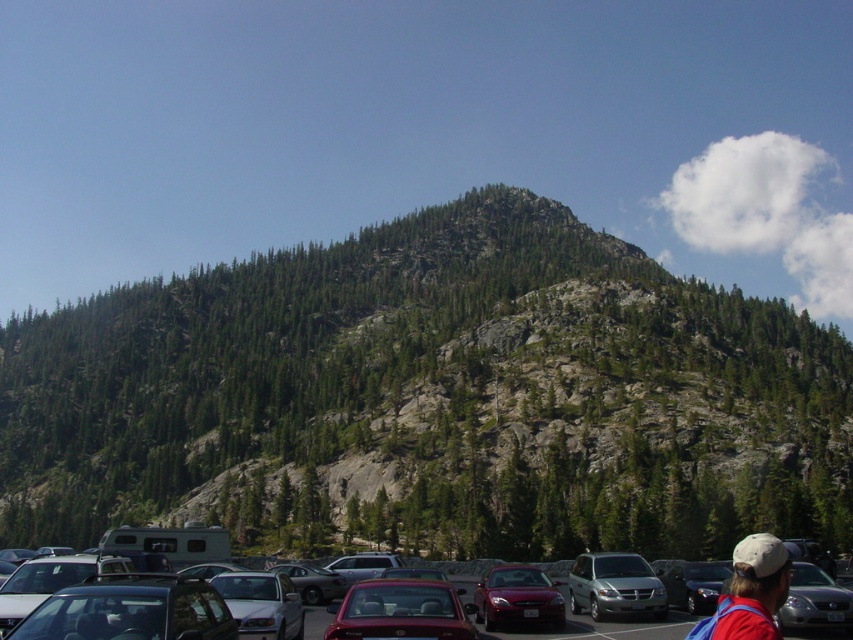
Question: Which of these objects is positioned closest to the metallic silver sedan at lower left?

Choices:
 (A) metallic silver sedan at center
 (B) metallic silver sedan at lower right

Answer: (A)

Question: Estimate the real-world distances between objects in this image. Which object is farther from the shiny red sedan at center?

Choices:
 (A) metallic silver sedan at center
 (B) metallic silver sedan at lower left

Answer: (B)

Question: Is metallic silver sedan at lower left positioned at the back of metallic silver sedan at lower right?

Choices:
 (A) no
 (B) yes

Answer: (A)

Question: Is matte red hatchback at center behind shiny red sedan at center?

Choices:
 (A) yes
 (B) no

Answer: (B)

Question: Among these objects, which one is farthest from the camera?

Choices:
 (A) green rocky mountain at center
 (B) shiny red sedan at center

Answer: (A)

Question: Can you confirm if green rocky mountain at center is bigger than red shirt at lower right?

Choices:
 (A) no
 (B) yes

Answer: (B)